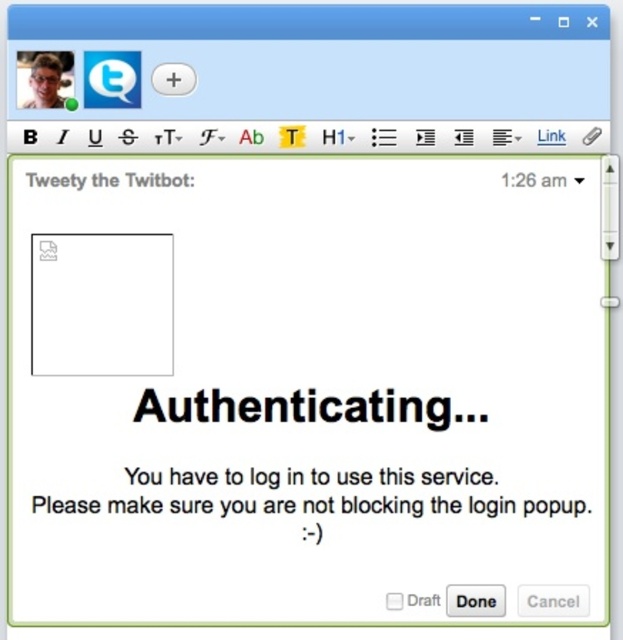
You are using the blogging platform and want to add a new post. The white matte square at upper left and black text at center are visible. Which object should you click first to start writing your post?

You should click the white matte square at upper left first because it is positioned to the left of the black text at center, indicating it might be the button to initiate the post creation process.